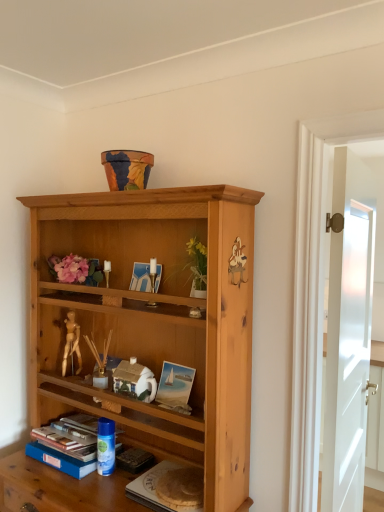
Question: Is point (360, 245) positioned closer to the camera than point (145, 475)?

Choices:
 (A) farther
 (B) closer

Answer: (A)

Question: Is white glossy door at right spatially inside hardcover book at lower center, or outside of it?

Choices:
 (A) outside
 (B) inside

Answer: (A)

Question: Which of these objects is positioned closest to the hardcover book at lower center?

Choices:
 (A) blue hardcover book at lower left
 (B) white glossy door at right
 (C) blue plastic can at lower center

Answer: (C)

Question: Considering the real-world distances, which object is farthest from the blue hardcover book at lower left?

Choices:
 (A) hardcover book at lower center
 (B) blue plastic can at lower center
 (C) white glossy door at right

Answer: (C)